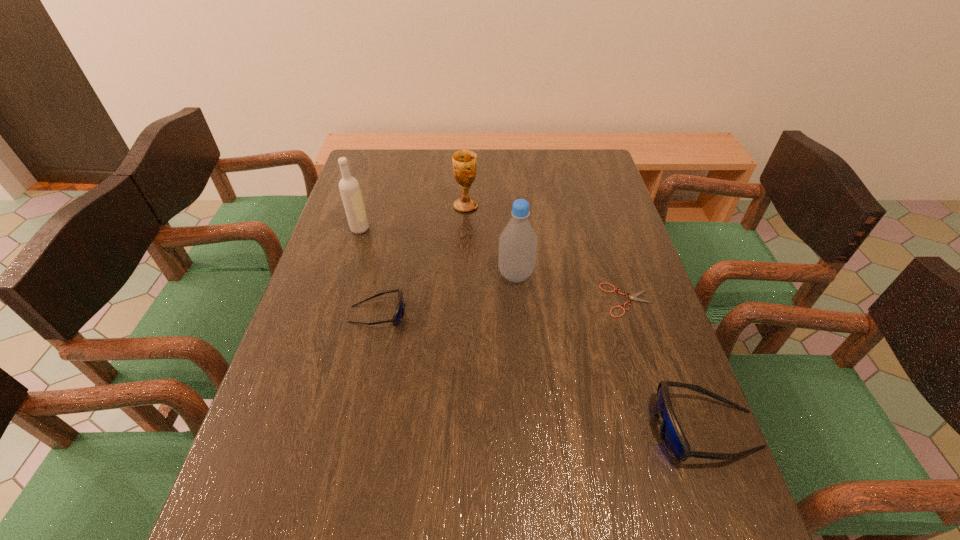
Image resolution: width=960 pixels, height=540 pixels. What are the coordinates of `vodka located at the left edge` in the screenshot? It's located at (349, 187).

You are a GUI agent. You are given a task and a screenshot of the screen. Output one action in this format:
    pyautogui.click(x=<x>, y=<y>)
    Task: Click on the sunglasses that is at the right edge
    The width and height of the screenshot is (960, 540).
    Given the screenshot: What is the action you would take?
    pyautogui.click(x=672, y=436)

Find the location of `shears located at the right edge`. shears located at the right edge is located at coordinates (632, 297).

Find the location of a particular element. The width and height of the screenshot is (960, 540). object at the near right corner is located at coordinates (672, 436).

Locate an element on the screen. vacant space at the far edge of the desktop is located at coordinates (443, 164).

The height and width of the screenshot is (540, 960). I want to click on vacant area at the near edge, so click(574, 455).

In the image, there is a desktop. At what (x,y) coordinates should I click in order to perform the action: click on vacant space at the left edge. Please return your answer as a coordinate pair (x, y). Image resolution: width=960 pixels, height=540 pixels. Looking at the image, I should click on (361, 263).

Locate an element on the screen. The width and height of the screenshot is (960, 540). blank area at the right edge is located at coordinates (613, 190).

Find the location of a particular element. Image resolution: width=960 pixels, height=540 pixels. unoccupied position between the leftmost object and the third object from right to left is located at coordinates (438, 252).

Where is `free space between the third object from left to right and the fourth object from left to right`? free space between the third object from left to right and the fourth object from left to right is located at coordinates (491, 240).